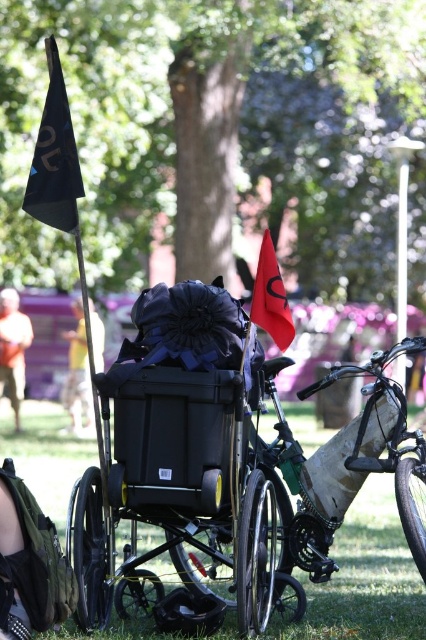
Question: Is metallic silver bicycle at center behind orange t-shirt at left?

Choices:
 (A) yes
 (B) no

Answer: (B)

Question: Is green grass at center in front of metallic silver bicycle at center?

Choices:
 (A) yes
 (B) no

Answer: (A)

Question: Which point is farther to the camera?

Choices:
 (A) (198, 470)
 (B) (290, 552)

Answer: (B)

Question: Among these objects, which one is farthest from the camera?

Choices:
 (A) orange t-shirt at left
 (B) green grass at center
 (C) red fabric flag at center

Answer: (A)

Question: Is yellow fabric pants at lower left above red fabric flag at center?

Choices:
 (A) yes
 (B) no

Answer: (B)

Question: Based on their relative distances, which object is nearer to the metallic silver bicycle at center?

Choices:
 (A) red fabric flag at center
 (B) black matte wheelchair at center

Answer: (A)